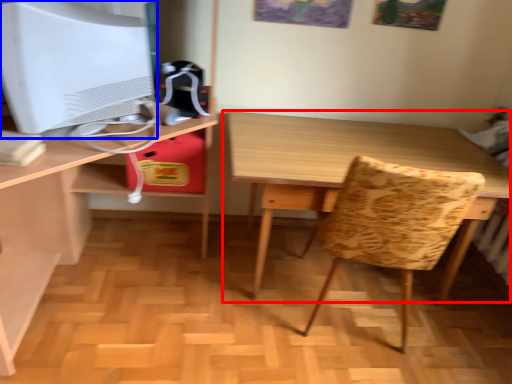
Question: Among these objects, which one is nearest to the camera, table (highlighted by a red box) or computer monitor (highlighted by a blue box)?

Choices:
 (A) table
 (B) computer monitor

Answer: (B)